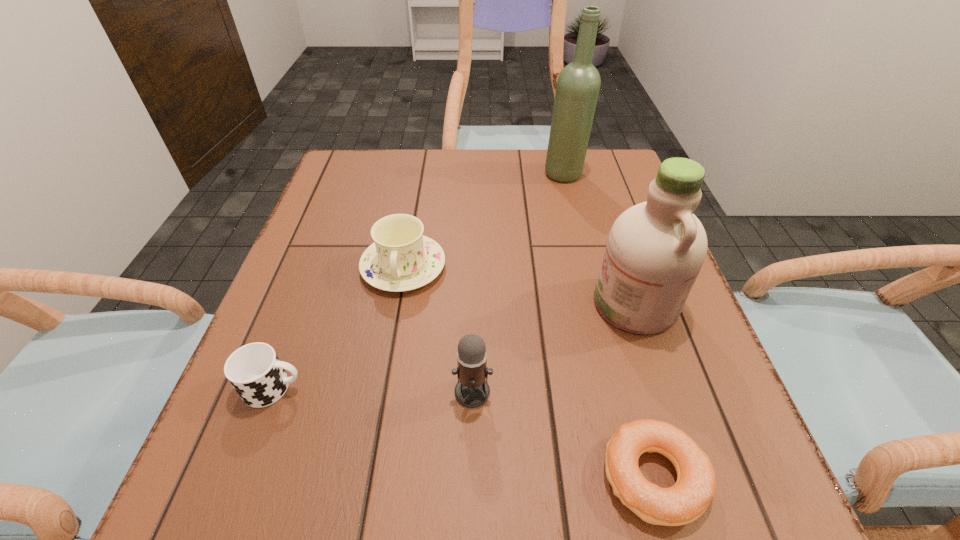
At what (x,y) coordinates should I click in order to perform the action: click on free spot that satisfies the following two spatial constraints: 1. on the front side of the tallest object; 2. on the right side of the bagel. Please return your answer as a coordinate pair (x, y). The width and height of the screenshot is (960, 540). Looking at the image, I should click on (638, 476).

The height and width of the screenshot is (540, 960). I want to click on vacant space that satisfies the following two spatial constraints: 1. on the front side of the tallest object; 2. on the left side of the bagel, so click(638, 476).

At what (x,y) coordinates should I click in order to perform the action: click on free point that satisfies the following two spatial constraints: 1. on the side of the second shortest object with the handle; 2. on the back side of the nearest object. Please return your answer as a coordinate pair (x, y). Image resolution: width=960 pixels, height=540 pixels. Looking at the image, I should click on (241, 476).

Where is `free space that satisfies the following two spatial constraints: 1. on the side of the second shortest object with the handle; 2. on the right side of the nearest object`? Image resolution: width=960 pixels, height=540 pixels. free space that satisfies the following two spatial constraints: 1. on the side of the second shortest object with the handle; 2. on the right side of the nearest object is located at coordinates (241, 476).

The image size is (960, 540). In order to click on vacant space that satisfies the following two spatial constraints: 1. on the side of the fifth tallest object with the handle; 2. on the back side of the nearest object in this screenshot , I will do `click(241, 476)`.